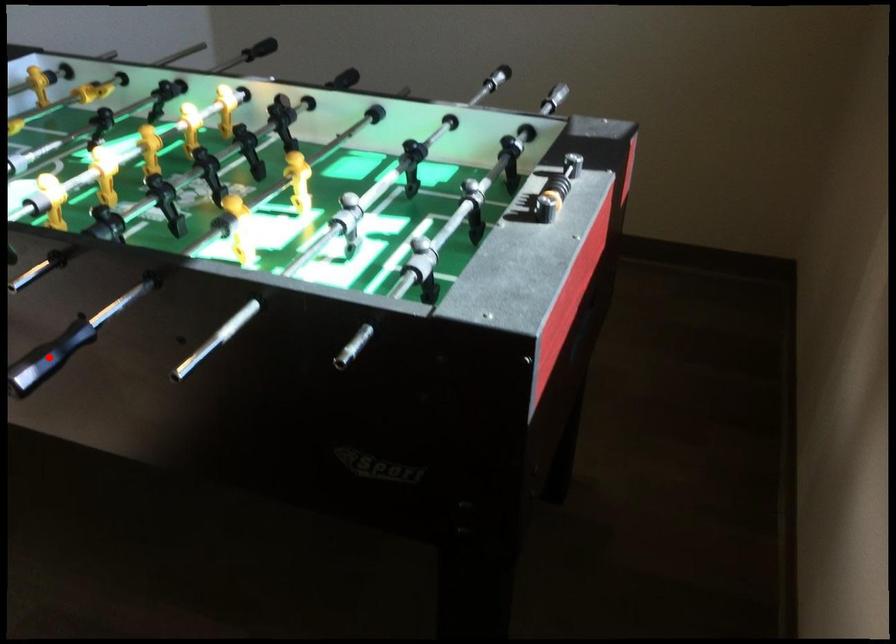
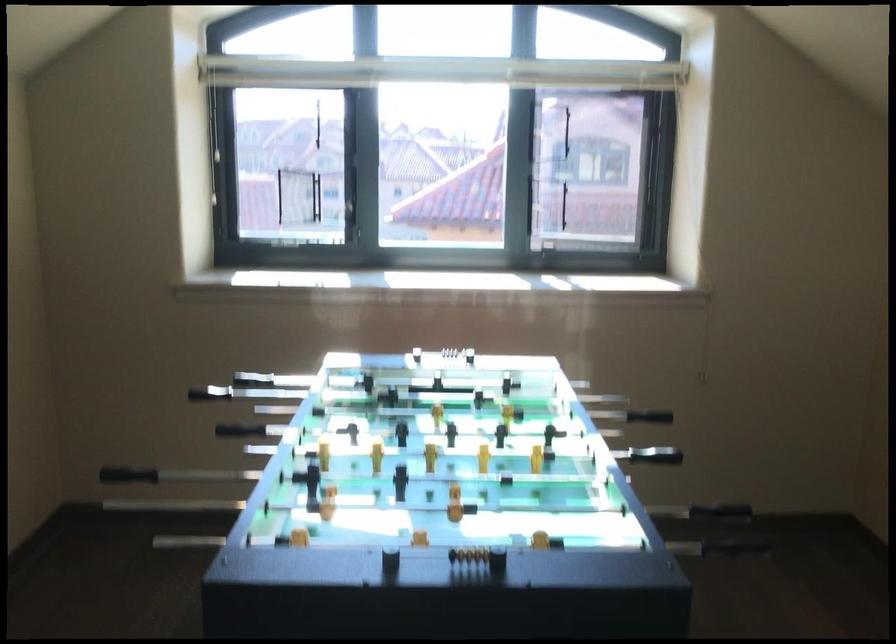
Question: I am providing you with two images of the same scene from different viewpoints. A red point is shown in image1. For the corresponding object point in image2, is it positioned nearer or farther from the camera?

Choices:
 (A) Nearer
 (B) Farther

Answer: (B)